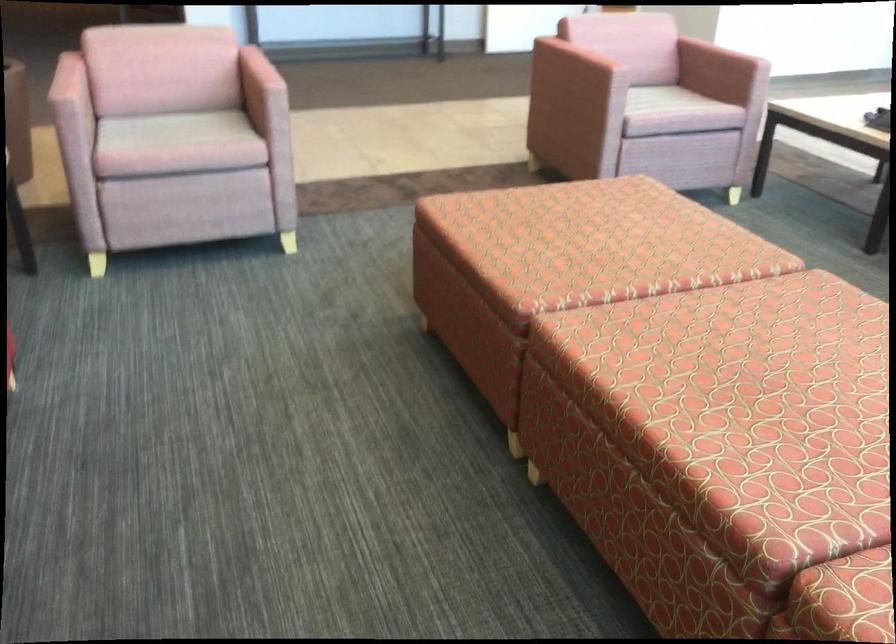
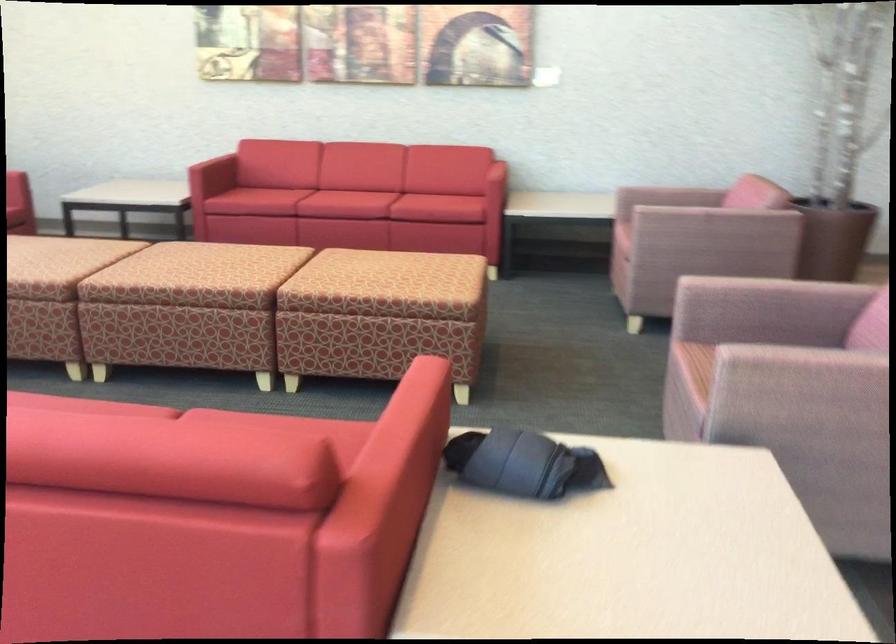
Where in the second image is the point corresponding to [128,102] from the first image?

(669, 196)